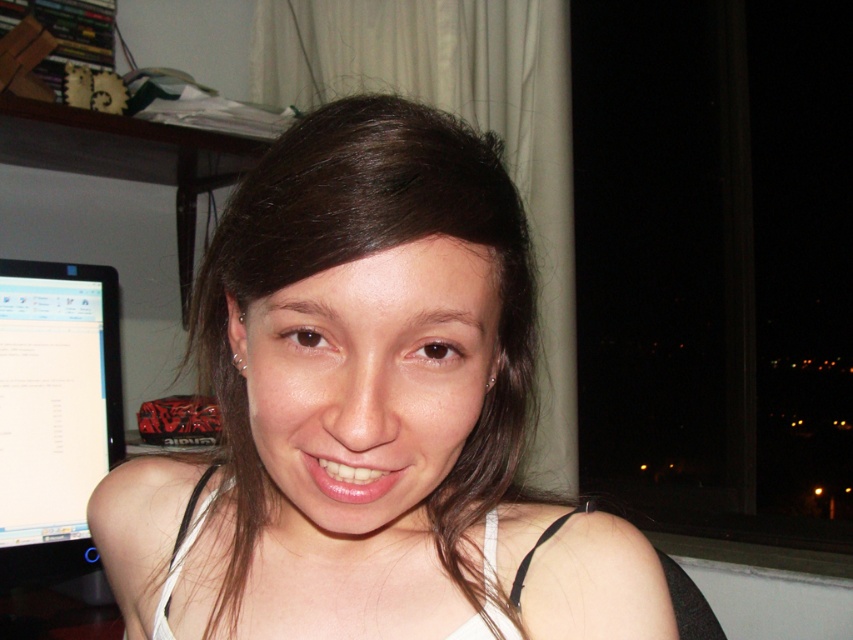
Question: Is smooth skin face at center smaller than black glossy monitor at left?

Choices:
 (A) no
 (B) yes

Answer: (A)

Question: Can you confirm if smooth skin face at center is positioned below black glossy monitor at left?

Choices:
 (A) yes
 (B) no

Answer: (B)

Question: Which of the following is the closest to the observer?

Choices:
 (A) (13, 289)
 (B) (193, 528)

Answer: (B)

Question: Among these objects, which one is farthest from the camera?

Choices:
 (A) black glossy monitor at left
 (B) smooth skin face at center

Answer: (A)

Question: Which of the following is the closest to the observer?

Choices:
 (A) black glossy monitor at left
 (B) smooth skin face at center

Answer: (B)

Question: Is smooth skin face at center positioned at the back of black glossy monitor at left?

Choices:
 (A) yes
 (B) no

Answer: (B)